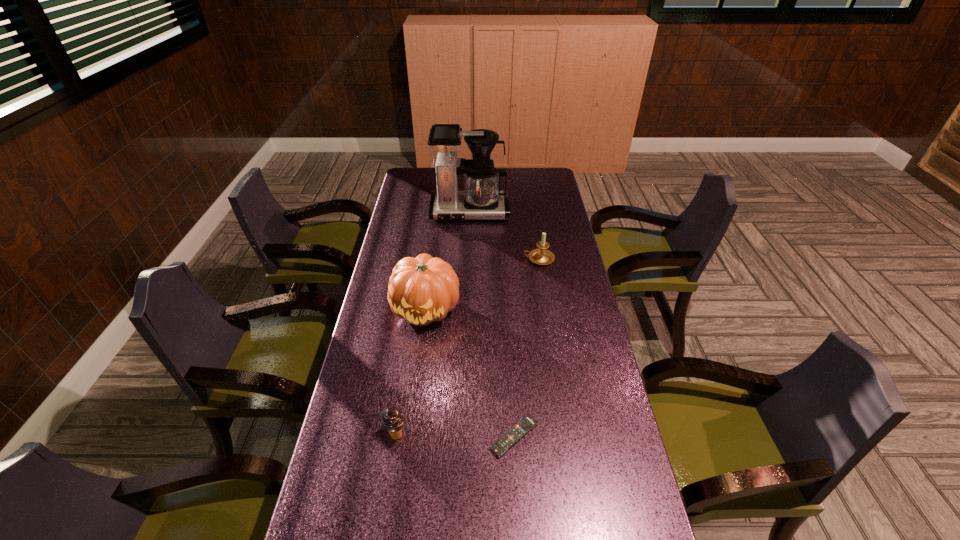
The height and width of the screenshot is (540, 960). What are the coordinates of `the farthest object` in the screenshot? It's located at (481, 199).

In order to click on the tallest object in this screenshot , I will do `click(481, 199)`.

Locate an element on the screen. The width and height of the screenshot is (960, 540). pumpkin is located at coordinates (424, 289).

Locate an element on the screen. This screenshot has width=960, height=540. the fourth shortest object is located at coordinates [x=424, y=289].

Locate an element on the screen. candle holder is located at coordinates (542, 256).

Where is `the rightmost object`? the rightmost object is located at coordinates (542, 256).

Find the location of `icecream`. icecream is located at coordinates (392, 420).

Where is `the shortest object`? The width and height of the screenshot is (960, 540). the shortest object is located at coordinates (526, 424).

This screenshot has width=960, height=540. Identify the location of free space located 0.390m at the front of the coffee maker where the controls are located. (467, 285).

What are the coordinates of `vacant area situated 0.300m on the carved face of the second tallest object` in the screenshot? It's located at (412, 420).